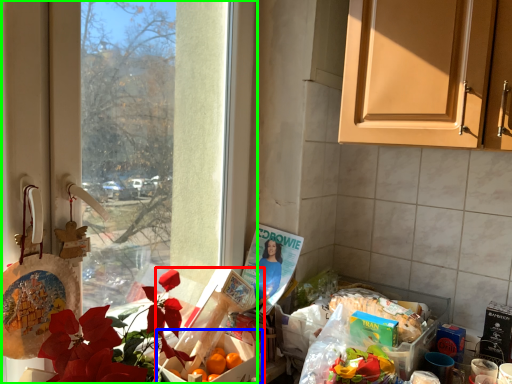
Question: Estimate the real-world distances between objects in this image. Which object is closer to box (highlighted by a red box), box (highlighted by a blue box) or window (highlighted by a green box)?

Choices:
 (A) box
 (B) window

Answer: (A)